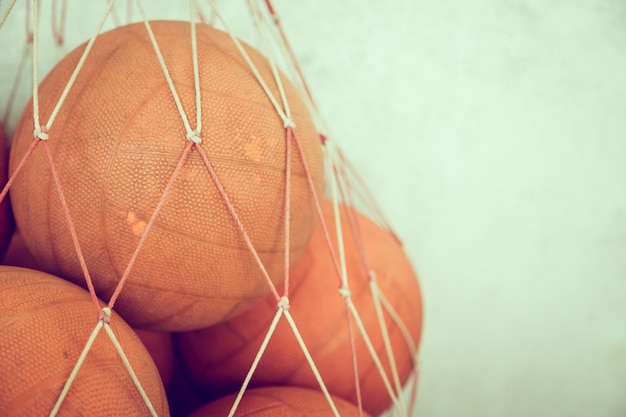
What are the coordinates of `ball storage` in the screenshot? It's located at (196, 137).